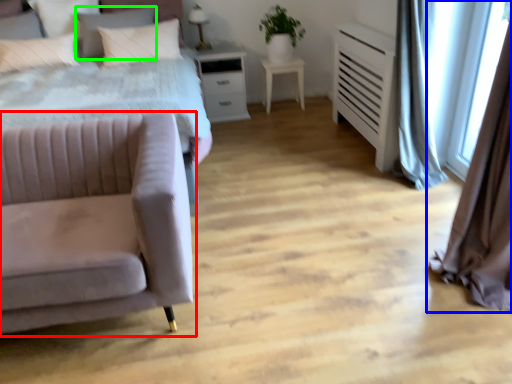
Question: Which object is positioned closest to studio couch (highlighted by a red box)? Select from curtain (highlighted by a blue box) and pillow (highlighted by a green box).

Choices:
 (A) curtain
 (B) pillow

Answer: (A)